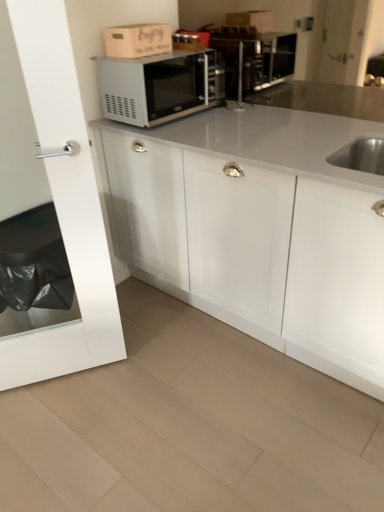
Question: From the image's perspective, is wooden cardboard box at upper center above white matte cabinet at center?

Choices:
 (A) yes
 (B) no

Answer: (A)

Question: Can you confirm if wooden cardboard box at upper center is positioned to the left of white matte cabinet at center?

Choices:
 (A) no
 (B) yes

Answer: (B)

Question: Is wooden cardboard box at upper center positioned with its back to white matte cabinet at center?

Choices:
 (A) yes
 (B) no

Answer: (B)

Question: Is wooden cardboard box at upper center oriented towards white matte cabinet at center?

Choices:
 (A) yes
 (B) no

Answer: (B)

Question: Is the depth of wooden cardboard box at upper center less than that of white matte cabinet at center?

Choices:
 (A) no
 (B) yes

Answer: (A)

Question: Is wooden cardboard box at upper center placed right next to white matte cabinet at center?

Choices:
 (A) yes
 (B) no

Answer: (B)

Question: Is transparent glass door at left completely or partially inside wooden cardboard box at upper center?

Choices:
 (A) yes
 (B) no

Answer: (B)

Question: Are wooden cardboard box at upper center and transparent glass door at left beside each other?

Choices:
 (A) no
 (B) yes

Answer: (A)

Question: Is wooden cardboard box at upper center facing towards transparent glass door at left?

Choices:
 (A) yes
 (B) no

Answer: (B)

Question: Is wooden cardboard box at upper center not inside transparent glass door at left?

Choices:
 (A) no
 (B) yes

Answer: (B)

Question: Would you consider wooden cardboard box at upper center to be distant from transparent glass door at left?

Choices:
 (A) yes
 (B) no

Answer: (B)

Question: From a real-world perspective, is wooden cardboard box at upper center on top of transparent glass door at left?

Choices:
 (A) yes
 (B) no

Answer: (A)

Question: From the image's perspective, is satin silver microwave at upper center below white matte cabinet at center?

Choices:
 (A) yes
 (B) no

Answer: (B)